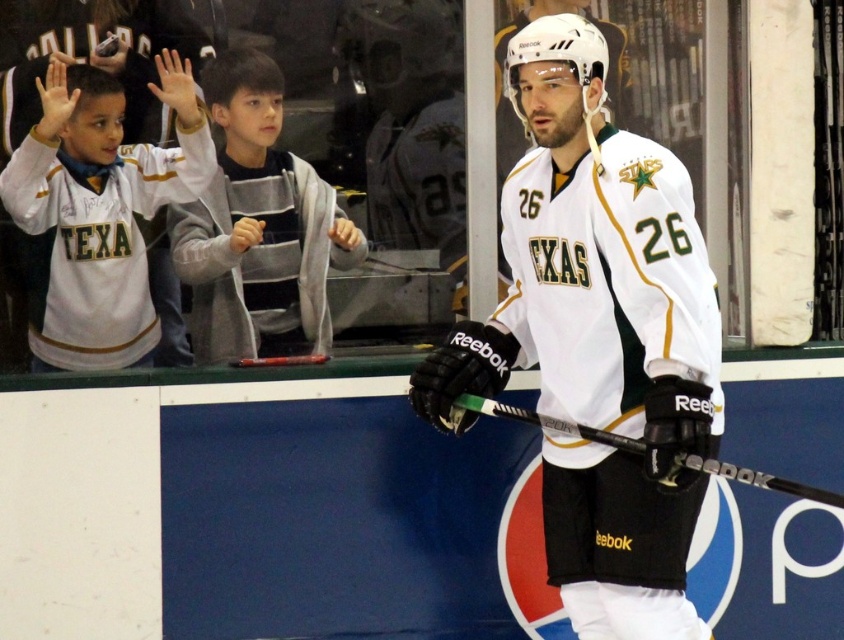
You are a photographer trying to capture a photo of the hockey player. You need to ensure both the white jersey at upper left and the black matte hockey stick at center are visible in the frame. Based on their positions, which object should you focus on first to include both in the shot?

The white jersey at upper left is positioned on the left side of the black matte hockey stick at center, so focusing on the black matte hockey stick at center first would allow you to adjust the frame to include both objects since the jersey is to the left of the stick.

You are a photographer positioned at the back of the rink. You need to take a photo of the hockey player holding the black matte hockey stick at center. However, there is a gray striped sweater at upper left in the way. Can you still capture the hockey player and the hockey stick clearly in your photo?

The gray striped sweater at upper left has a greater height compared to black matte hockey stick at center. Since the sweater is taller than the stick, it might block the view of the hockey stick. Therefore, you may not be able to capture the hockey player and the hockey stick clearly in the photo.

You are a sports equipment manager checking the inventory. You have two white jerseys in storage. The first one is labeled as the white matte jersey at center, and the second is the white jersey at upper left. Which jersey has a greater width?

The white matte jersey at center has a greater width than the white jersey at upper left according to the description.